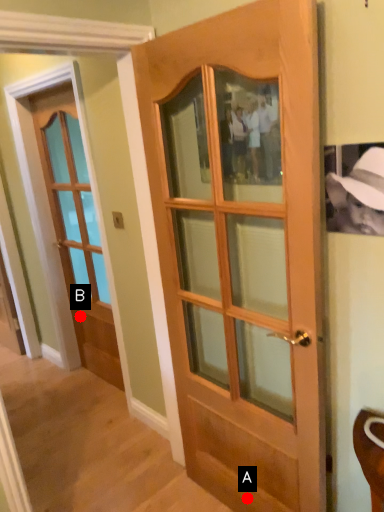
Question: Two points are circled on the image, labeled by A and B beside each circle. Among these points, which one is nearest to the camera?

Choices:
 (A) A is closer
 (B) B is closer

Answer: (A)